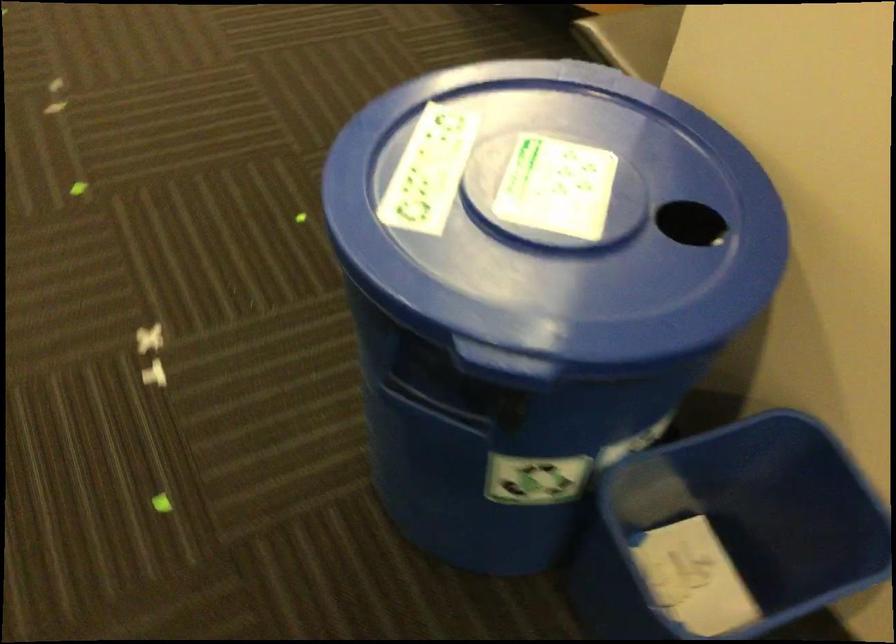
Describe the element at coordinates (426, 406) in the screenshot. I see `the blue bin handle` at that location.